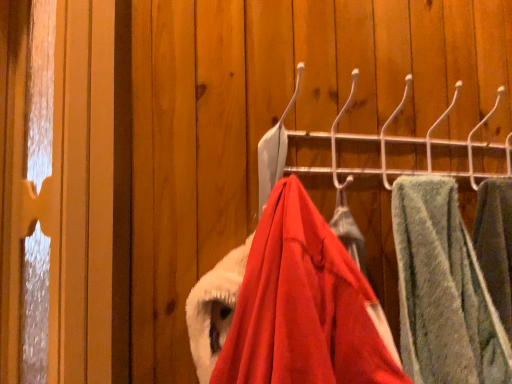
The image size is (512, 384). What are the coordinates of `metallic hook rack at center, which ranks as the 1th closet in top-to-bottom order` in the screenshot? It's located at (370, 141).

Describe the element at coordinates (443, 290) in the screenshot. I see `green fuzzy towel at right` at that location.

This screenshot has height=384, width=512. What do you see at coordinates (277, 119) in the screenshot? I see `velvet red coat at center, the 1th closet positioned from the bottom` at bounding box center [277, 119].

The width and height of the screenshot is (512, 384). What are the coordinates of `metallic hook rack at center, which ranks as the 1th closet in top-to-bottom order` in the screenshot? It's located at (370, 141).

At what (x,y) coordinates should I click in order to perform the action: click on towel on the right side of metallic hook rack at center, which ranks as the 1th closet in top-to-bottom order. Please return your answer as a coordinate pair (x, y). Image resolution: width=512 pixels, height=384 pixels. Looking at the image, I should click on (443, 290).

Is green fuzzy towel at right looking in the opposite direction of metallic hook rack at center, which ranks as the second closet in bottom-to-top order?

No, green fuzzy towel at right is not facing the opposite direction of metallic hook rack at center, which ranks as the second closet in bottom-to-top order.

Considering the relative sizes of green fuzzy towel at right and metallic hook rack at center, which ranks as the 1th closet in top-to-bottom order, in the image provided, is green fuzzy towel at right taller than metallic hook rack at center, which ranks as the 1th closet in top-to-bottom order,?

Correct, green fuzzy towel at right is much taller as metallic hook rack at center, which ranks as the 1th closet in top-to-bottom order.

Is velvet red coat at center, which is the 2th closet in top-to-bottom order, at the back of metallic hook rack at center, which ranks as the 1th closet in top-to-bottom order?

metallic hook rack at center, which ranks as the 1th closet in top-to-bottom order, does not have its back to velvet red coat at center, which is the 2th closet in top-to-bottom order.

Is metallic hook rack at center, which ranks as the second closet in bottom-to-top order, wider than velvet red coat at center, which is the 2th closet in top-to-bottom order?

Incorrect, the width of metallic hook rack at center, which ranks as the second closet in bottom-to-top order, does not surpass that of velvet red coat at center, which is the 2th closet in top-to-bottom order.

Can you see metallic hook rack at center, which ranks as the second closet in bottom-to-top order, touching velvet red coat at center, the 1th closet positioned from the bottom?

Yes, metallic hook rack at center, which ranks as the second closet in bottom-to-top order, is with velvet red coat at center, the 1th closet positioned from the bottom.

From the picture: Which is more to the left, metallic hook rack at center, which ranks as the 1th closet in top-to-bottom order, or velvet red coat at center, which is the 2th closet in top-to-bottom order?

Positioned to the left is velvet red coat at center, which is the 2th closet in top-to-bottom order.

Looking at this image, from the image's perspective, between green fuzzy towel at right and velvet red coat at center, which is the 2th closet in top-to-bottom order, which one is located above?

From the image's view, velvet red coat at center, which is the 2th closet in top-to-bottom order, is above.

Between green fuzzy towel at right and velvet red coat at center, the 1th closet positioned from the bottom, which one has smaller width?

With smaller width is green fuzzy towel at right.

Between green fuzzy towel at right and velvet red coat at center, which is the 2th closet in top-to-bottom order, which one appears on the right side from the viewer's perspective?

From the viewer's perspective, green fuzzy towel at right appears more on the right side.

Based on their sizes in the image, would you say velvet red coat at center, which is the 2th closet in top-to-bottom order, is bigger or smaller than metallic hook rack at center, which ranks as the second closet in bottom-to-top order?

velvet red coat at center, which is the 2th closet in top-to-bottom order, is bigger than metallic hook rack at center, which ranks as the second closet in bottom-to-top order.

Which of these two, velvet red coat at center, the 1th closet positioned from the bottom, or metallic hook rack at center, which ranks as the second closet in bottom-to-top order, is wider?

With larger width is velvet red coat at center, the 1th closet positioned from the bottom.

Is velvet red coat at center, the 1th closet positioned from the bottom, oriented towards metallic hook rack at center, which ranks as the 1th closet in top-to-bottom order?

No, velvet red coat at center, the 1th closet positioned from the bottom, is not oriented towards metallic hook rack at center, which ranks as the 1th closet in top-to-bottom order.

From a real-world perspective, is velvet red coat at center, the 1th closet positioned from the bottom, physically above metallic hook rack at center, which ranks as the second closet in bottom-to-top order?

No, from a real-world perspective, velvet red coat at center, the 1th closet positioned from the bottom, is not above metallic hook rack at center, which ranks as the second closet in bottom-to-top order.

Considering the relative sizes of velvet red coat at center, the 1th closet positioned from the bottom, and green fuzzy towel at right in the image provided, is velvet red coat at center, the 1th closet positioned from the bottom, taller than green fuzzy towel at right?

No, velvet red coat at center, the 1th closet positioned from the bottom, is not taller than green fuzzy towel at right.

Considering the positions of objects velvet red coat at center, which is the 2th closet in top-to-bottom order, and green fuzzy towel at right in the image provided, who is more to the left, velvet red coat at center, which is the 2th closet in top-to-bottom order, or green fuzzy towel at right?

Positioned to the left is velvet red coat at center, which is the 2th closet in top-to-bottom order.

Does velvet red coat at center, which is the 2th closet in top-to-bottom order, turn towards green fuzzy towel at right?

No, velvet red coat at center, which is the 2th closet in top-to-bottom order, is not turned towards green fuzzy towel at right.

Based on the photo, which is closer to the camera, (269,136) or (458,244)?

Point (269,136) is positioned closer to the camera compared to point (458,244).

From the picture: Is metallic hook rack at center, which ranks as the 1th closet in top-to-bottom order, looking in the opposite direction of green fuzzy towel at right?

No, metallic hook rack at center, which ranks as the 1th closet in top-to-bottom order, is not facing the opposite direction of green fuzzy towel at right.

From a real-world perspective, is metallic hook rack at center, which ranks as the 1th closet in top-to-bottom order, physically located above or below green fuzzy towel at right?

metallic hook rack at center, which ranks as the 1th closet in top-to-bottom order, is above green fuzzy towel at right.

Considering the relative positions of metallic hook rack at center, which ranks as the second closet in bottom-to-top order, and green fuzzy towel at right in the image provided, is metallic hook rack at center, which ranks as the second closet in bottom-to-top order, to the left or to the right of green fuzzy towel at right?

In the image, metallic hook rack at center, which ranks as the second closet in bottom-to-top order, appears on the left side of green fuzzy towel at right.

Identify the location of closet behind the green fuzzy towel at right. (370, 141).

Identify the location of closet on the right of velvet red coat at center, which is the 2th closet in top-to-bottom order. This screenshot has height=384, width=512. (370, 141).

Based on their spatial positions, is velvet red coat at center, which is the 2th closet in top-to-bottom order, or metallic hook rack at center, which ranks as the second closet in bottom-to-top order, further from green fuzzy towel at right?

velvet red coat at center, which is the 2th closet in top-to-bottom order, is further to green fuzzy towel at right.

Based on their spatial positions, is metallic hook rack at center, which ranks as the 1th closet in top-to-bottom order, or velvet red coat at center, the 1th closet positioned from the bottom, closer to green fuzzy towel at right?

metallic hook rack at center, which ranks as the 1th closet in top-to-bottom order, is closer to green fuzzy towel at right.

Considering their positions, is green fuzzy towel at right positioned closer to velvet red coat at center, the 1th closet positioned from the bottom, than metallic hook rack at center, which ranks as the 1th closet in top-to-bottom order?

Based on the image, metallic hook rack at center, which ranks as the 1th closet in top-to-bottom order, appears to be nearer to velvet red coat at center, the 1th closet positioned from the bottom.

When comparing their distances from metallic hook rack at center, which ranks as the second closet in bottom-to-top order, does velvet red coat at center, the 1th closet positioned from the bottom, or green fuzzy towel at right seem further?

green fuzzy towel at right is positioned further to the anchor metallic hook rack at center, which ranks as the second closet in bottom-to-top order.

Which object lies further to the anchor point velvet red coat at center, which is the 2th closet in top-to-bottom order, metallic hook rack at center, which ranks as the second closet in bottom-to-top order, or green fuzzy towel at right?

Among the two, green fuzzy towel at right is located further to velvet red coat at center, which is the 2th closet in top-to-bottom order.

Looking at the image, which one is located closer to metallic hook rack at center, which ranks as the second closet in bottom-to-top order, green fuzzy towel at right or velvet red coat at center, the 1th closet positioned from the bottom?

Among the two, velvet red coat at center, the 1th closet positioned from the bottom, is located nearer to metallic hook rack at center, which ranks as the second closet in bottom-to-top order.

Where is `closet situated between velvet red coat at center, which is the 2th closet in top-to-bottom order, and green fuzzy towel at right from left to right`? The width and height of the screenshot is (512, 384). closet situated between velvet red coat at center, which is the 2th closet in top-to-bottom order, and green fuzzy towel at right from left to right is located at coordinates (370, 141).